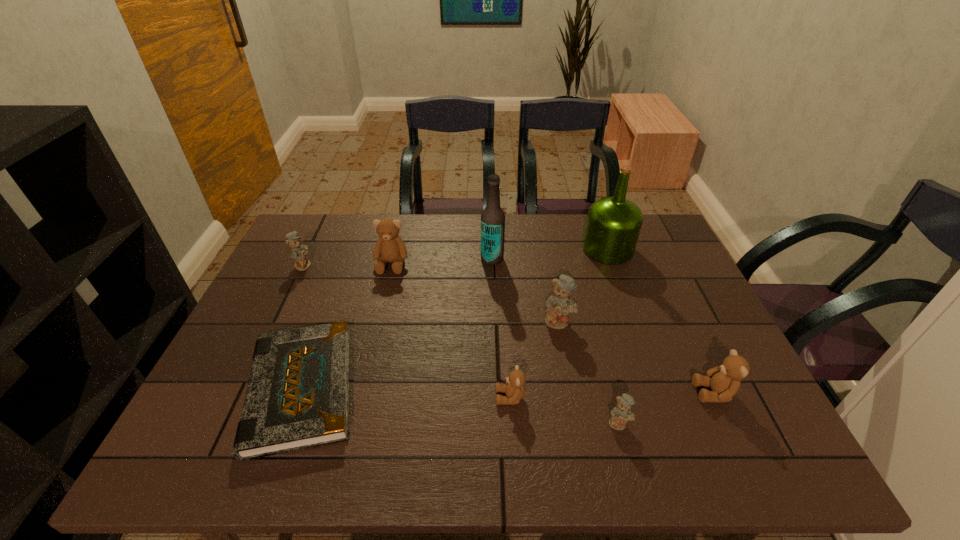
Locate an element on the screen. The image size is (960, 540). the eighth object from left to right is located at coordinates (613, 225).

Locate an element on the screen. This screenshot has height=540, width=960. green olive oil is located at coordinates (613, 225).

The width and height of the screenshot is (960, 540). I want to click on beer bottle, so click(492, 217).

Where is `the fifth farthest object`? This screenshot has height=540, width=960. the fifth farthest object is located at coordinates (560, 304).

The image size is (960, 540). I want to click on the third farthest teddy bear, so click(x=560, y=304).

What are the coordinates of `the biggest brown teddy bear` in the screenshot? It's located at (389, 247).

The height and width of the screenshot is (540, 960). I want to click on the fifth teddy bear from right to left, so click(389, 247).

At what (x,y) coordinates should I click in order to perform the action: click on the second smallest blue teddy bear. Please return your answer as a coordinate pair (x, y). Looking at the image, I should click on (298, 252).

In order to click on the leftmost teddy bear in this screenshot , I will do coord(298,252).

What are the coordinates of `the rightmost teddy bear` in the screenshot? It's located at (724, 380).